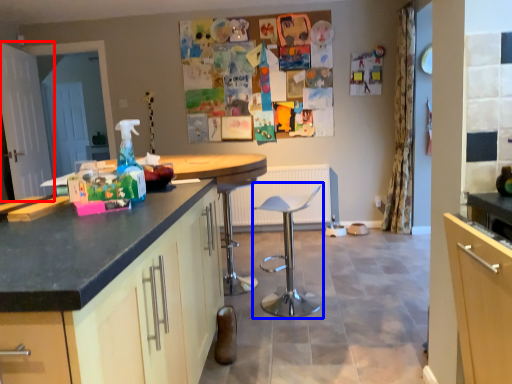
Question: Which object appears farthest to the camera in this image, screen door (highlighted by a red box) or swivel chair (highlighted by a blue box)?

Choices:
 (A) screen door
 (B) swivel chair

Answer: (A)